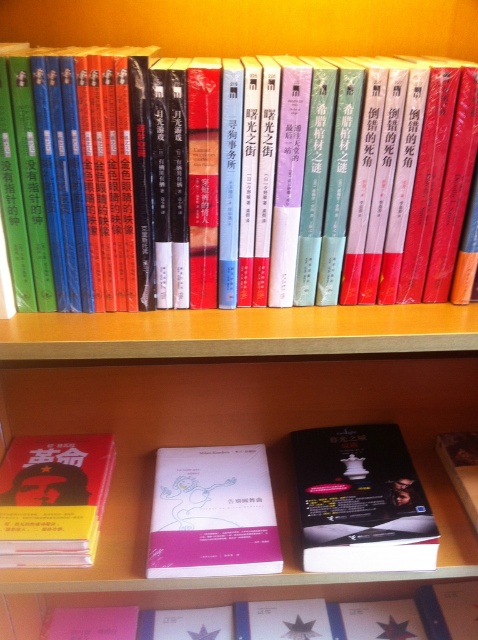
You are organizing books on a shelf and need to place the hardcover book at center and the pink matte book at center next to each other. Which book requires more horizontal space?

The hardcover book at center requires more horizontal space because its width surpasses that of the pink matte book at center.

You are standing in front of the bookshelf and want to reach a point that is exactly 24 inches away from you. Can you confirm if the point at coordinates point (64, 173) is within your reach?

The distance between point (64, 173) and the viewer is 23.94 inches, which is very close to 24 inches. Therefore, the point at coordinates point (64, 173) is within your reach.

Where is the hardcover book at center located in the image?

The hardcover book at center is located at point (245, 184).